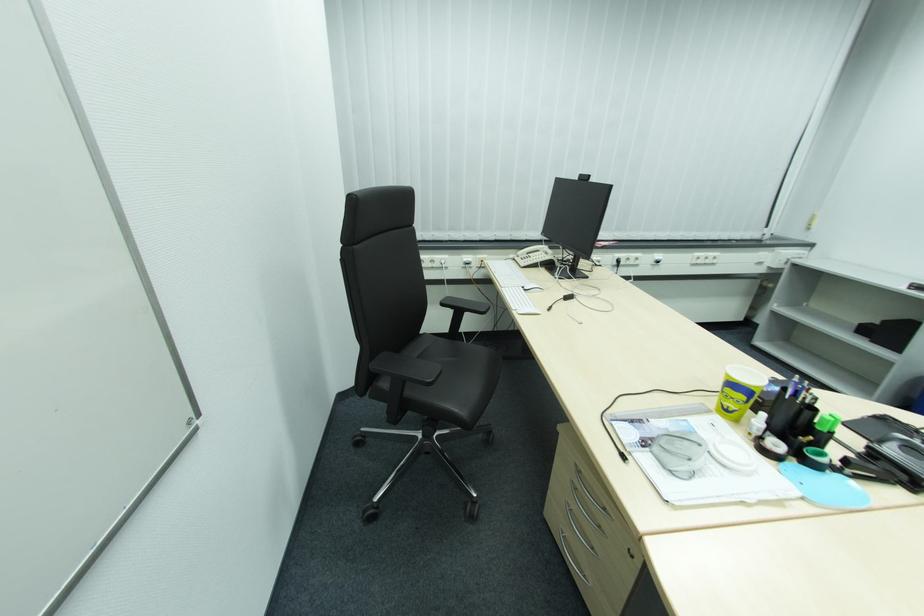
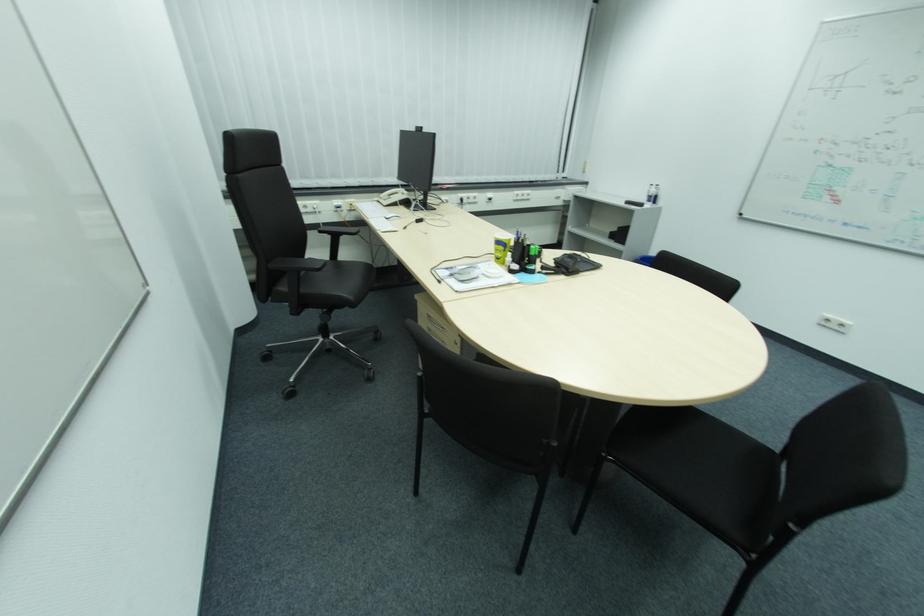
Find the pixel in the second image that matches the point at 524,307 in the first image.

(386, 229)